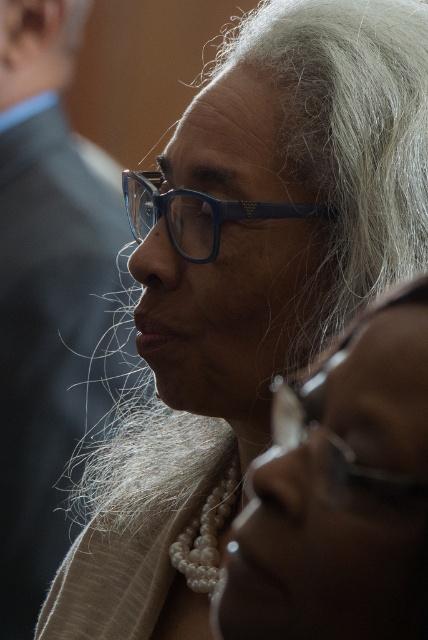
Is pearl necklace at center smaller than metallic silver glasses at lower right?

Actually, pearl necklace at center might be larger than metallic silver glasses at lower right.

Which of these two, pearl necklace at center or metallic silver glasses at lower right, stands shorter?

With less height is metallic silver glasses at lower right.

Where is `pearl necklace at center`? pearl necklace at center is located at coordinates (341, 493).

Does dark gray suit at left appear over metallic silver glasses at lower right?

Indeed, dark gray suit at left is positioned over metallic silver glasses at lower right.

Can you confirm if dark gray suit at left is positioned to the left of metallic silver glasses at lower right?

Correct, you'll find dark gray suit at left to the left of metallic silver glasses at lower right.

This screenshot has height=640, width=428. What are the coordinates of `dark gray suit at left` in the screenshot? It's located at (47, 298).

Which is behind, point (71, 288) or point (208, 241)?

Positioned behind is point (71, 288).

Is point (98, 326) closer to camera compared to point (130, 182)?

That is False.

Does point (32, 596) come in front of point (143, 179)?

That is False.

The width and height of the screenshot is (428, 640). In order to click on dark gray suit at left in this screenshot , I will do `click(47, 298)`.